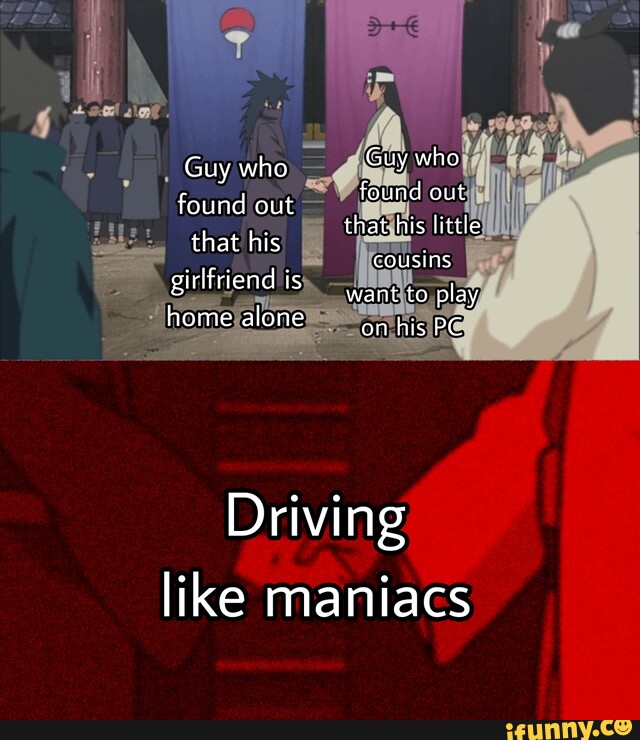
What are the coordinates of `these look like stairs` in the screenshot? It's located at (313, 164), (288, 468).